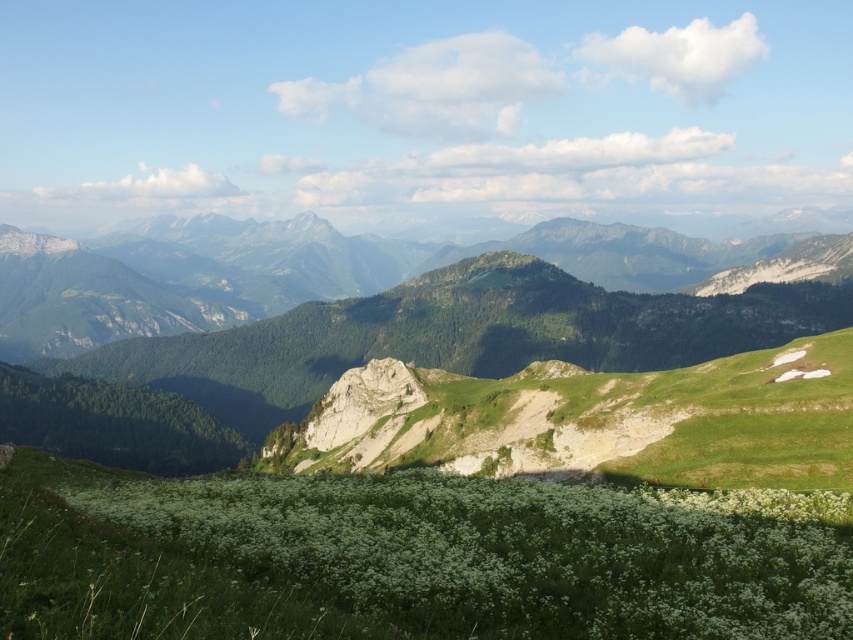
You are standing at the base of the rocky outcrop in the mountainous landscape. You see a point marked at coordinates point (398, 557). What is the terrain like at that point?

The point (398, 557) is on green leafy grass at center, so the terrain there is covered in lush green grass with small white flowers, creating a vibrant and soft surface.

You are standing in the meadow and want to take a photo of the green grassy mountain range at center. Which direction should you face to ensure the green leafy grass at center is not blocking your view?

You should face to the left of the green grassy mountain range at center because the green leafy grass at center is to the right of it, so facing left would keep the grass out of the frame.

You are a hiker planning to cross the green leafy grass at center and the green grassy mountain range at center. Which path would be wider for your hiking gear?

The green grassy mountain range at center is wider than the green leafy grass at center, so the path through the green grassy mountain range at center would be wider for your hiking gear.